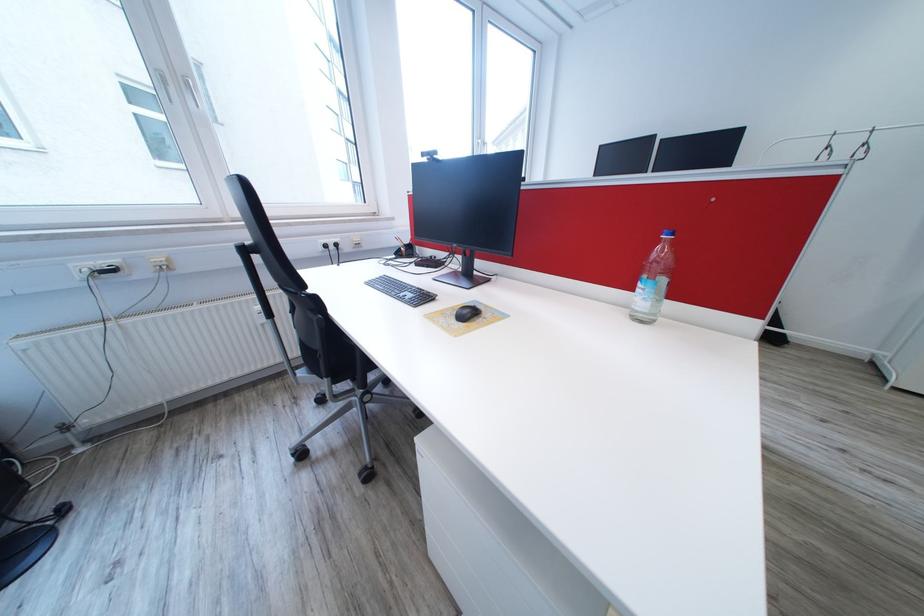
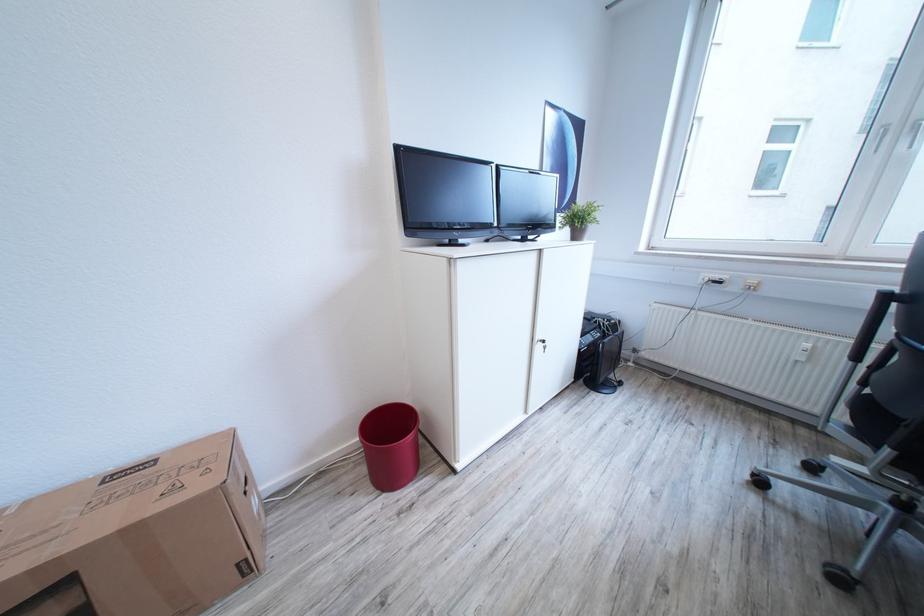
How did the camera likely rotate?

The rotation direction of the camera is left-down.